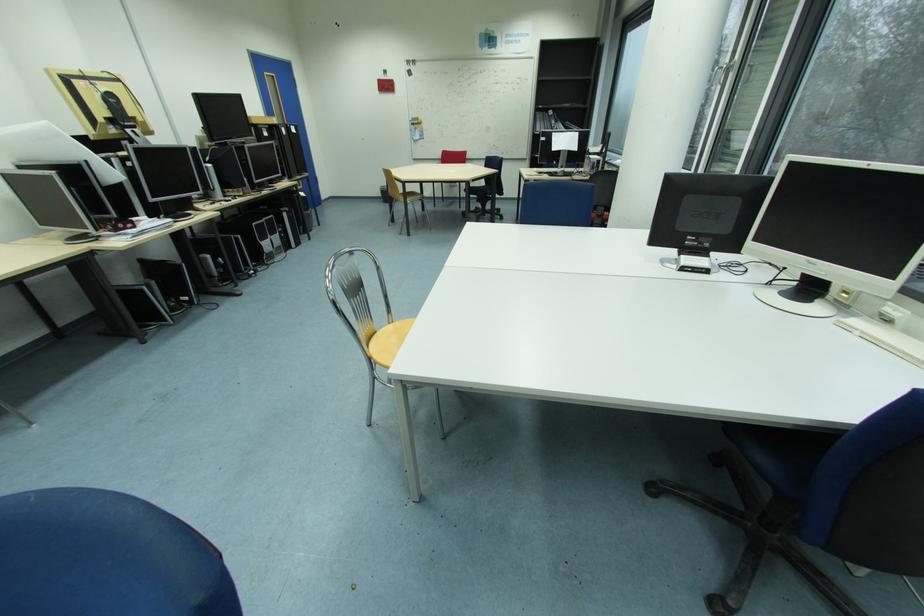
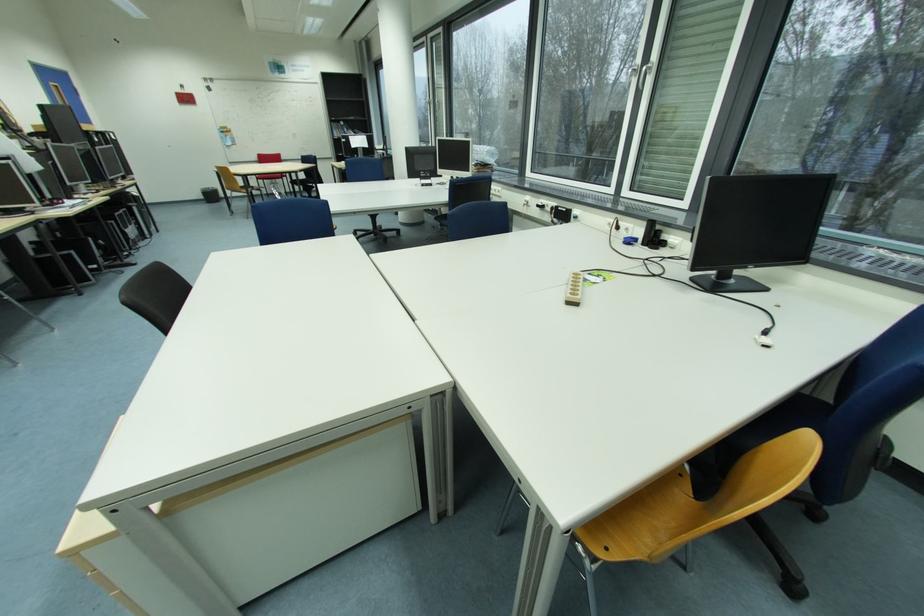
In the second image, find the point that corresponds to the point at 387,196 in the first image.

(209, 198)